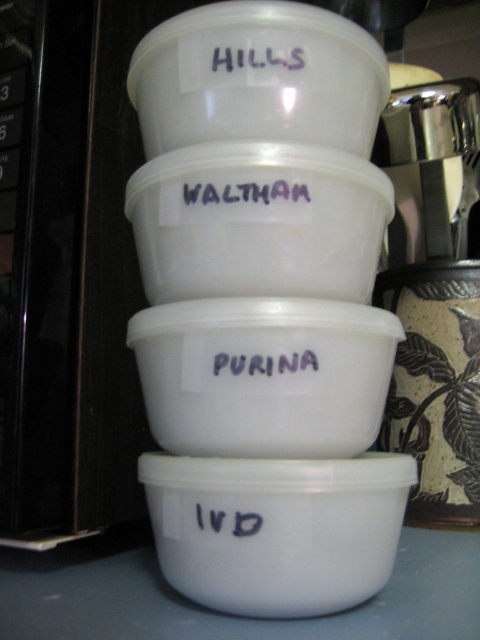
Question: Considering the real-world distances, which object is closest to the matte white text at center?

Choices:
 (A) black matte text at center
 (B) transparent plastic bowl at center

Answer: (B)

Question: Which point is closer to the camera taking this photo?

Choices:
 (A) (354, 84)
 (B) (272, 49)
 (C) (213, 305)

Answer: (C)

Question: Which object is the closest to the white matte bowl at center?

Choices:
 (A) white plastic bowl at upper center
 (B) matte white text at center
 (C) black matte text at center
 (D) transparent plastic bowl at center

Answer: (C)

Question: Does white plastic bowl at upper center appear over white matte label at upper center?

Choices:
 (A) yes
 (B) no

Answer: (B)

Question: Is white matte bowl at lower center thinner than transparent plastic bowl at center?

Choices:
 (A) yes
 (B) no

Answer: (A)

Question: Is white matte bowl at center further to camera compared to black matte text at center?

Choices:
 (A) yes
 (B) no

Answer: (B)